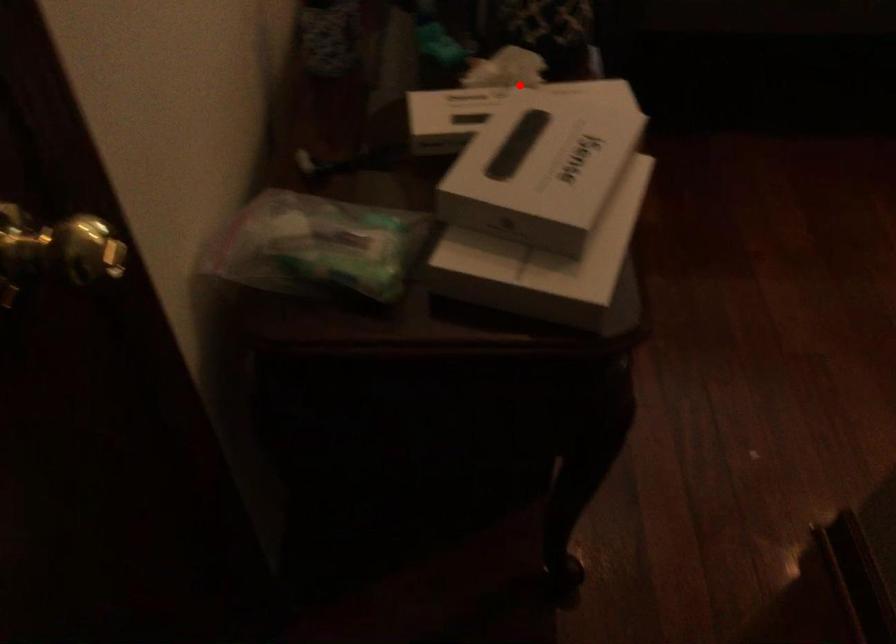
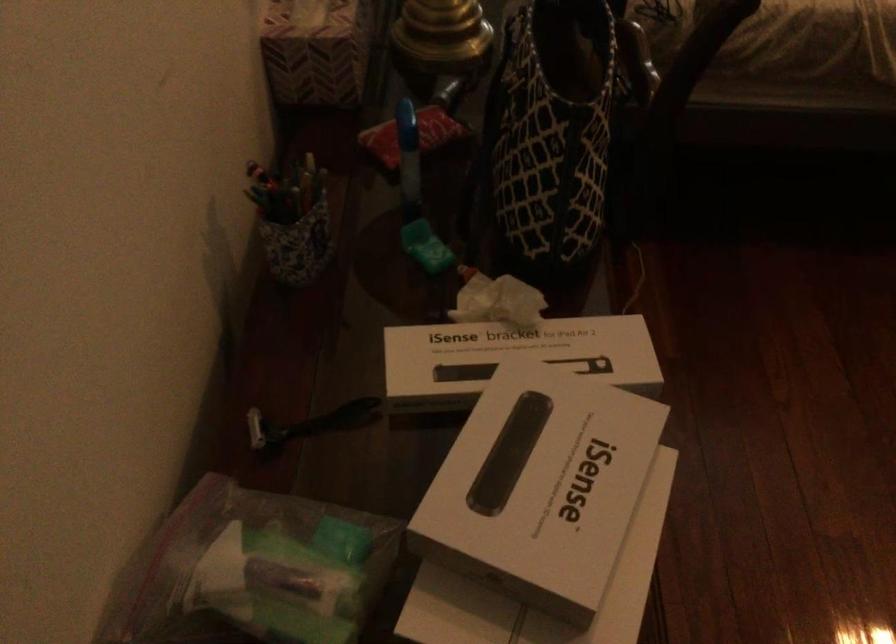
Find the pixel in the second image that matches the highlighted location in the first image.

(515, 353)